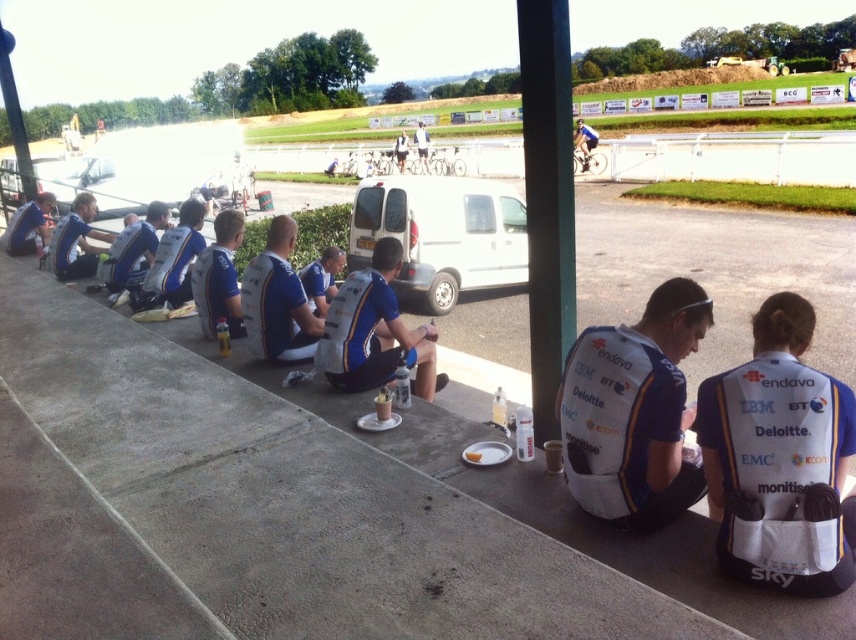
Question: Is concrete ledge at lower left smaller than matte blue jersey at left?

Choices:
 (A) yes
 (B) no

Answer: (B)

Question: Can you confirm if white fabric backpack at lower right is positioned to the right of white fabric jacket at center?

Choices:
 (A) no
 (B) yes

Answer: (B)

Question: Which of the following is the closest to the observer?

Choices:
 (A) (248, 568)
 (B) (607, 412)

Answer: (A)

Question: Where is concrete ledge at lower left located in relation to matte blue jersey at left in the image?

Choices:
 (A) above
 (B) below

Answer: (B)

Question: Which is farther from the white fabric backpack at lower right?

Choices:
 (A) matte blue jersey at center
 (B) concrete ledge at lower left
 (C) blue jersey at center

Answer: (A)

Question: Which object is positioned farthest from the blue jersey at center?

Choices:
 (A) white fabric backpack at lower right
 (B) white fabric jersey at center
 (C) concrete ledge at lower left

Answer: (A)